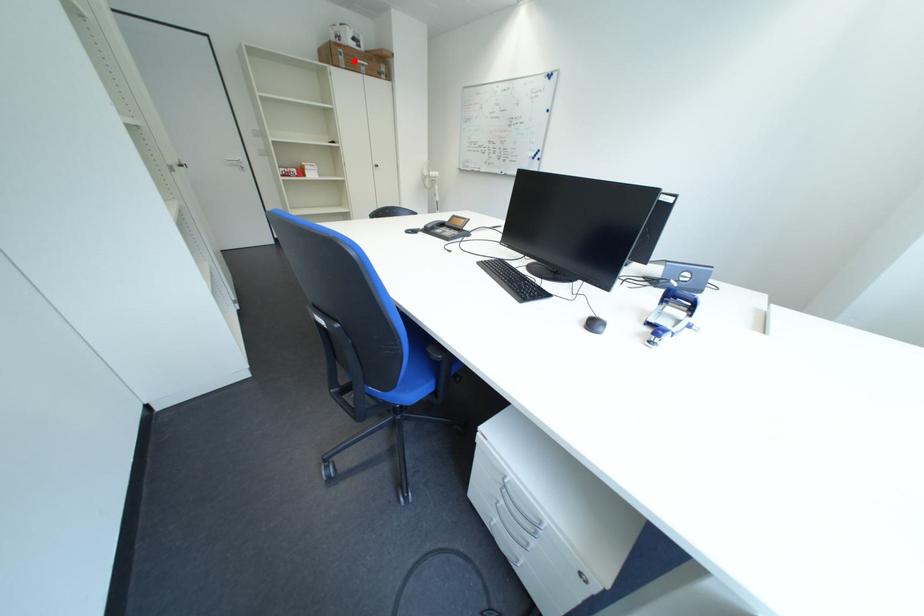
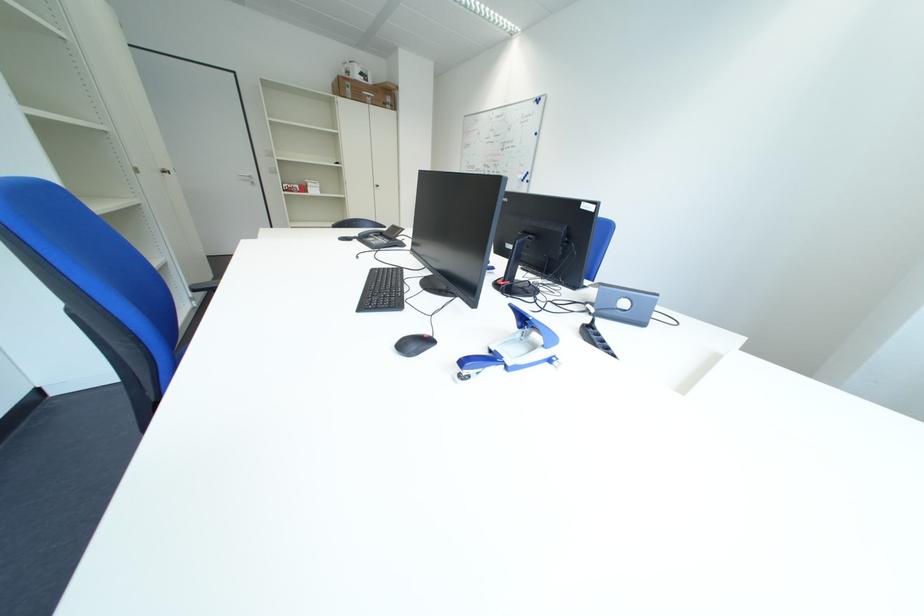
Find the pixel in the second image that matches the highlighted location in the first image.

(360, 92)